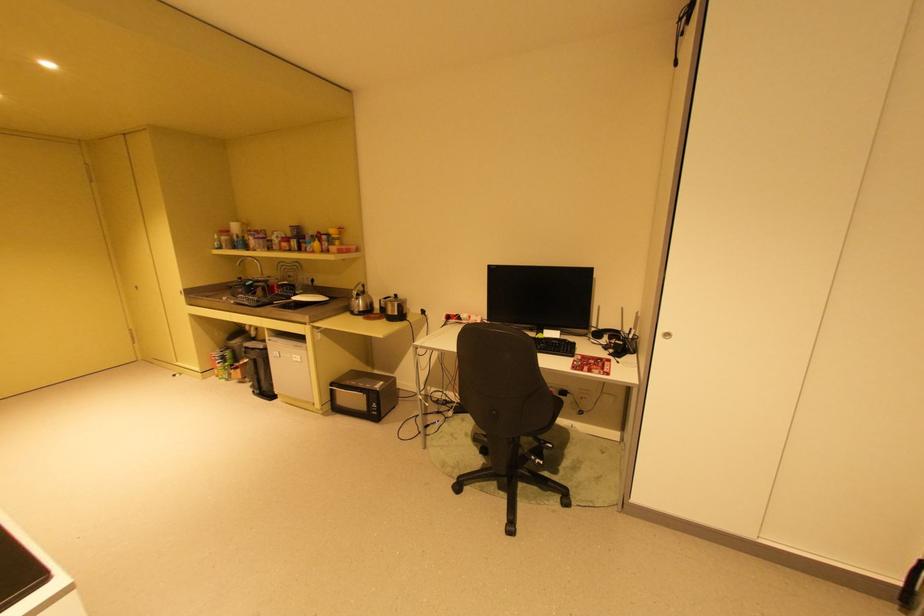
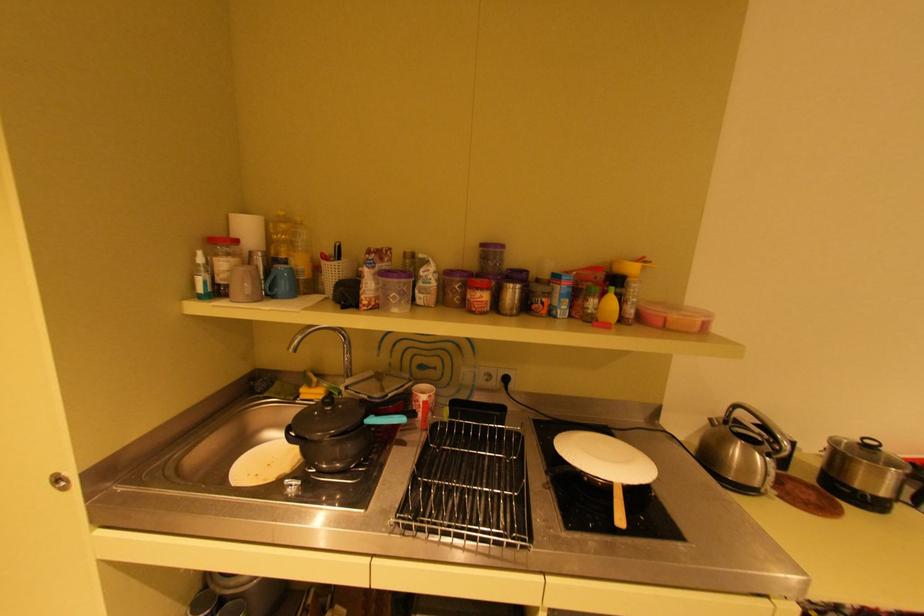
Looking at this image, in a continuous first-person perspective shot, in which direction is the camera moving?

The cameraman walked toward left, forward.